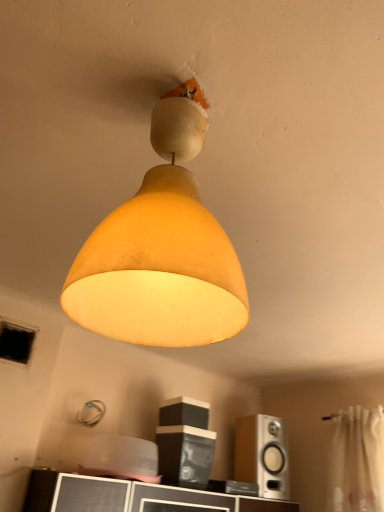
Question: Can we say silver metallic speaker at lower right, which is the second speaker in left-to-right order, lies outside matte black speaker at center, the first speaker positioned from the top?

Choices:
 (A) yes
 (B) no

Answer: (A)

Question: Is silver metallic speaker at lower right, acting as the 1th speaker starting from the right, at the left side of matte black speaker at center, the 2th speaker when ordered from bottom to top?

Choices:
 (A) yes
 (B) no

Answer: (B)

Question: Is silver metallic speaker at lower right, which is the second speaker in left-to-right order, not near matte black speaker at center, the first speaker positioned from the top?

Choices:
 (A) no
 (B) yes

Answer: (A)

Question: Does silver metallic speaker at lower right, which appears as the 1th speaker when ordered from the bottom, turn towards matte black speaker at center, the 1th speaker when ordered from left to right?

Choices:
 (A) no
 (B) yes

Answer: (A)

Question: From a real-world perspective, does silver metallic speaker at lower right, acting as the 1th speaker starting from the right, stand above matte black speaker at center, the 2th speaker when ordered from bottom to top?

Choices:
 (A) no
 (B) yes

Answer: (A)

Question: Is point (357, 423) positioned closer to the camera than point (261, 494)?

Choices:
 (A) closer
 (B) farther

Answer: (B)

Question: From a real-world perspective, relative to silver metallic speaker at lower right, which is the second speaker in left-to-right order, is white sheer curtain at right vertically above or below?

Choices:
 (A) below
 (B) above

Answer: (A)

Question: Is white sheer curtain at right situated inside silver metallic speaker at lower right, which is the second speaker in top-to-bottom order, or outside?

Choices:
 (A) outside
 (B) inside

Answer: (A)

Question: Visually, is white sheer curtain at right positioned to the left or to the right of silver metallic speaker at lower right, acting as the 1th speaker starting from the right?

Choices:
 (A) right
 (B) left

Answer: (A)

Question: Is point (261, 423) closer or farther from the camera than point (178, 422)?

Choices:
 (A) farther
 (B) closer

Answer: (A)

Question: Considering the positions of silver metallic speaker at lower right, acting as the 1th speaker starting from the right, and matte black speaker at center, positioned as the 2th speaker in right-to-left order, in the image, is silver metallic speaker at lower right, acting as the 1th speaker starting from the right, taller or shorter than matte black speaker at center, positioned as the 2th speaker in right-to-left order,?

Choices:
 (A) short
 (B) tall

Answer: (B)

Question: From a real-world perspective, is silver metallic speaker at lower right, which is the second speaker in top-to-bottom order, above or below matte black speaker at center, positioned as the 2th speaker in right-to-left order?

Choices:
 (A) below
 (B) above

Answer: (A)

Question: In the image, is silver metallic speaker at lower right, acting as the 1th speaker starting from the right, on the left side or the right side of matte black speaker at center, positioned as the 2th speaker in right-to-left order?

Choices:
 (A) right
 (B) left

Answer: (A)

Question: Considering the positions of point (339, 490) and point (168, 186), is point (339, 490) closer or farther from the camera than point (168, 186)?

Choices:
 (A) farther
 (B) closer

Answer: (A)

Question: From the image's perspective, relative to matte yellow lampshade at center, is white sheer curtain at right above or below?

Choices:
 (A) above
 (B) below

Answer: (B)